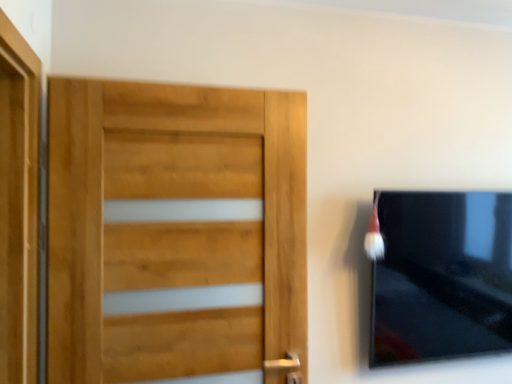
You are a GUI agent. You are given a task and a screenshot of the screen. Output one action in this format:
    pyautogui.click(x=<x>, y=<y>)
    Task: Click on the white fluffy brush at upper right
    The width and height of the screenshot is (512, 384).
    Given the screenshot: What is the action you would take?
    pyautogui.click(x=374, y=235)

You are a GUI agent. You are given a task and a screenshot of the screen. Output one action in this format:
    pyautogui.click(x=<x>, y=<y>)
    Task: Click on the matte black tv at right
    The width and height of the screenshot is (512, 384).
    Given the screenshot: What is the action you would take?
    pos(442,276)

You are a GUI agent. You are given a task and a screenshot of the screen. Output one action in this format:
    pyautogui.click(x=<x>, y=<y>)
    Task: Click on the light brown wood door at left
    The width and height of the screenshot is (512, 384).
    Given the screenshot: What is the action you would take?
    pyautogui.click(x=173, y=230)

You are a GUI agent. You are given a task and a screenshot of the screen. Output one action in this format:
    pyautogui.click(x=<x>, y=<y>)
    Task: Click on the white fluffy brush at upper right
    The width and height of the screenshot is (512, 384).
    Given the screenshot: What is the action you would take?
    pyautogui.click(x=374, y=235)

Identify the location of brush that appears on the left of matte black tv at right. (374, 235).

In the scene shown: From a real-world perspective, is matte black tv at right located beneath white fluffy brush at upper right?

Yes.

Is matte black tv at right at the left side of white fluffy brush at upper right?

In fact, matte black tv at right is to the right of white fluffy brush at upper right.

Considering the positions of objects matte black tv at right and white fluffy brush at upper right in the image provided, who is in front, matte black tv at right or white fluffy brush at upper right?

white fluffy brush at upper right.

Which of these two, light brown wood door at left or matte black tv at right, is bigger?

With larger size is matte black tv at right.

Are light brown wood door at left and matte black tv at right located far from each other?

They are positioned close to each other.

Which is correct: light brown wood door at left is inside matte black tv at right, or outside of it?

light brown wood door at left lies outside matte black tv at right.

Does matte black tv at right come in front of light brown wood door at left?

No, matte black tv at right is behind light brown wood door at left.

Is there a large distance between matte black tv at right and light brown wood door at left?

No.

Does matte black tv at right have a greater width compared to light brown wood door at left?

Indeed, matte black tv at right has a greater width compared to light brown wood door at left.

From the image's perspective, is matte black tv at right located above or below light brown wood door at left?

Based on their image positions, matte black tv at right is located beneath light brown wood door at left.

Can you tell me how much white fluffy brush at upper right and light brown wood door at left differ in facing direction?

0.946 degrees.

Which is in front, point (379, 193) or point (223, 196)?

Point (223, 196)

Which object is more forward, white fluffy brush at upper right or light brown wood door at left?

light brown wood door at left is more forward.

Considering the relative sizes of white fluffy brush at upper right and light brown wood door at left in the image provided, is white fluffy brush at upper right smaller than light brown wood door at left?

Indeed, white fluffy brush at upper right has a smaller size compared to light brown wood door at left.

Is light brown wood door at left far from white fluffy brush at upper right?

No.

Visually, is light brown wood door at left positioned to the left or to the right of white fluffy brush at upper right?

From the image, it's evident that light brown wood door at left is to the left of white fluffy brush at upper right.

Which of these two, light brown wood door at left or white fluffy brush at upper right, stands taller?

With more height is light brown wood door at left.

Which object is positioned more to the right, white fluffy brush at upper right or matte black tv at right?

From the viewer's perspective, matte black tv at right appears more on the right side.

How different are the orientations of white fluffy brush at upper right and matte black tv at right in degrees?

2.83e-06 degrees.

Does white fluffy brush at upper right lie in front of matte black tv at right?

Yes, white fluffy brush at upper right is closer to the camera.

Considering the sizes of objects white fluffy brush at upper right and matte black tv at right in the image provided, who is wider, white fluffy brush at upper right or matte black tv at right?

matte black tv at right is wider.

The width and height of the screenshot is (512, 384). In order to click on picture frame below the white fluffy brush at upper right (from a real-world perspective) in this screenshot , I will do `click(442, 276)`.

Where is `door in front of the matte black tv at right`? The height and width of the screenshot is (384, 512). door in front of the matte black tv at right is located at coordinates (173, 230).

From the image, which object appears to be nearer to white fluffy brush at upper right, light brown wood door at left or matte black tv at right?

matte black tv at right is closer to white fluffy brush at upper right.

Based on their spatial positions, is white fluffy brush at upper right or matte black tv at right further from light brown wood door at left?

The object further to light brown wood door at left is matte black tv at right.

Considering their positions, is matte black tv at right positioned closer to white fluffy brush at upper right than light brown wood door at left?

matte black tv at right lies closer to white fluffy brush at upper right than the other object.

Looking at the image, which one is located closer to light brown wood door at left, matte black tv at right or white fluffy brush at upper right?

Among the two, white fluffy brush at upper right is located nearer to light brown wood door at left.

When comparing their distances from matte black tv at right, does light brown wood door at left or white fluffy brush at upper right seem further?

The object further to matte black tv at right is light brown wood door at left.

Looking at this image, which object lies further to the anchor point matte black tv at right, white fluffy brush at upper right or light brown wood door at left?

light brown wood door at left is further to matte black tv at right.

You are a GUI agent. You are given a task and a screenshot of the screen. Output one action in this format:
    pyautogui.click(x=<x>, y=<y>)
    Task: Click on the brush located between light brown wood door at left and matte black tv at right in the left-right direction
    
    Given the screenshot: What is the action you would take?
    pyautogui.click(x=374, y=235)